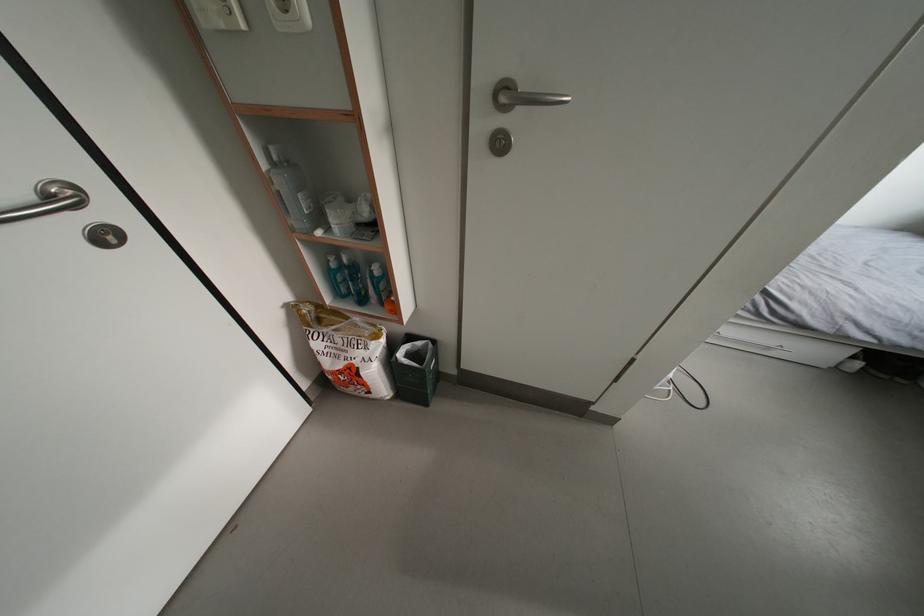
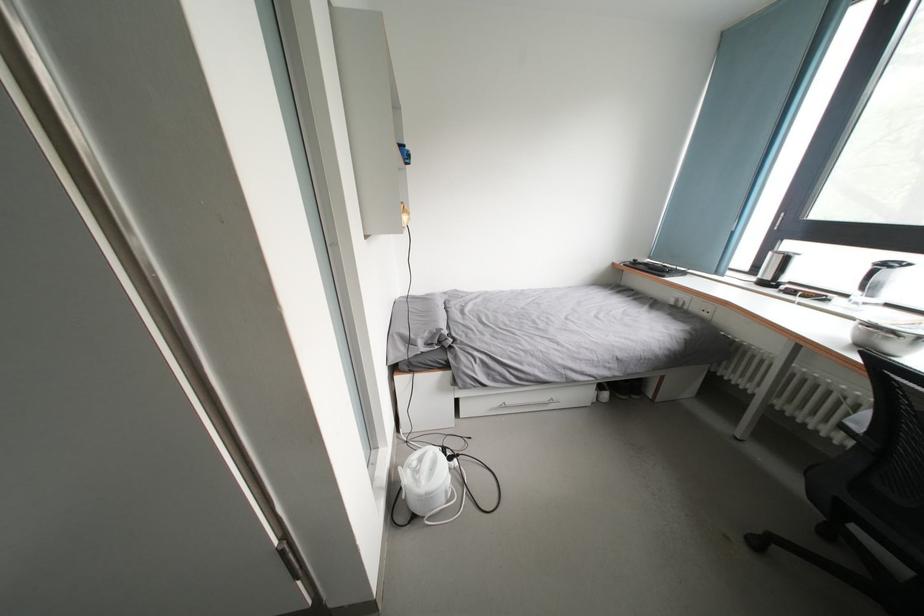
The first image is from the beginning of the video and the second image is from the end. How did the camera likely rotate when shooting the video?

The rotation direction of the camera is right-up.